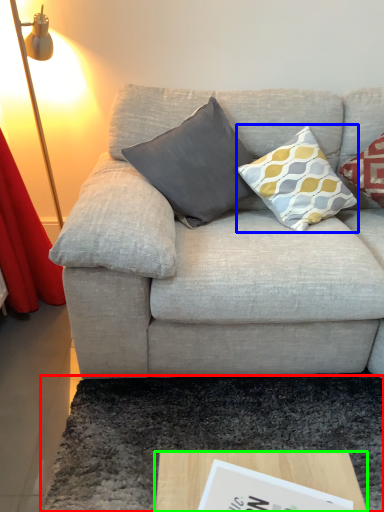
Question: Based on their relative distances, which object is farther from mat (highlighted by a red box)? Choose from pillow (highlighted by a blue box) and coffee table (highlighted by a green box).

Choices:
 (A) pillow
 (B) coffee table

Answer: (A)